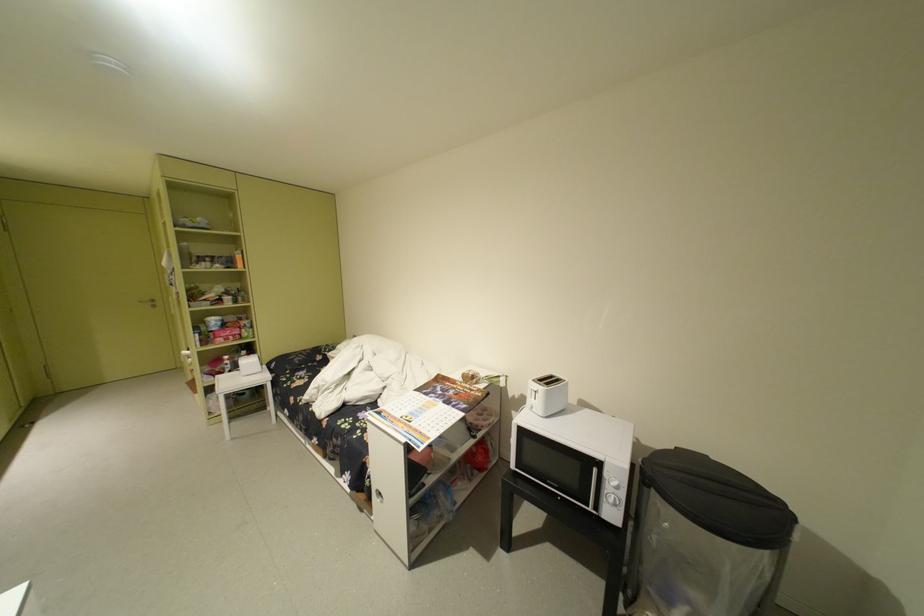
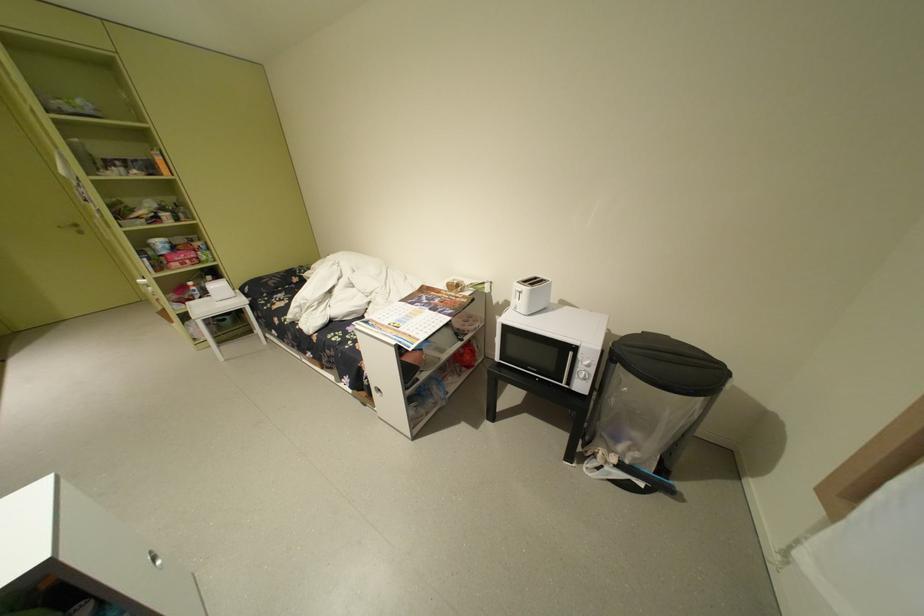
In the second image, find the point that corresponds to (x=616, y=500) in the first image.

(588, 377)